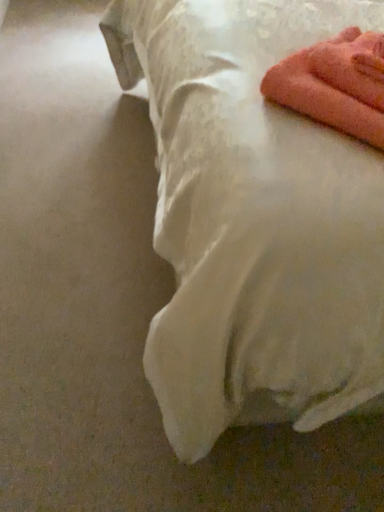
Find the location of a particular element. The image size is (384, 512). pink fluffy towel at upper right is located at coordinates (335, 84).

What do you see at coordinates (335, 84) in the screenshot? I see `pink fluffy towel at upper right` at bounding box center [335, 84].

What do you see at coordinates (254, 221) in the screenshot? I see `white satin bed at upper right` at bounding box center [254, 221].

Locate an element on the screen. Image resolution: width=384 pixels, height=512 pixels. white satin bed at upper right is located at coordinates (254, 221).

Measure the distance between white satin bed at upper right and camera.

The distance of white satin bed at upper right from camera is 25.53 inches.

What is the approximate height of white satin bed at upper right?

white satin bed at upper right is 1.03 meters tall.

This screenshot has width=384, height=512. I want to click on pink fluffy towel at upper right, so click(x=335, y=84).

Which is more to the right, white satin bed at upper right or pink fluffy towel at upper right?

pink fluffy towel at upper right.

Considering the positions of objects white satin bed at upper right and pink fluffy towel at upper right in the image provided, who is in front, white satin bed at upper right or pink fluffy towel at upper right?

Positioned in front is white satin bed at upper right.

Considering the points (227, 323) and (265, 90), which point is in front, point (227, 323) or point (265, 90)?

Positioned in front is point (227, 323).

From the image's perspective, between white satin bed at upper right and pink fluffy towel at upper right, which one is located above?

white satin bed at upper right.

From a real-world perspective, does white satin bed at upper right sit lower than pink fluffy towel at upper right?

Indeed, from a real-world perspective, white satin bed at upper right is positioned beneath pink fluffy towel at upper right.

Looking at their sizes, would you say white satin bed at upper right is wider or thinner than pink fluffy towel at upper right?

In the image, white satin bed at upper right appears to be wider than pink fluffy towel at upper right.

Considering the sizes of objects white satin bed at upper right and pink fluffy towel at upper right in the image provided, who is shorter, white satin bed at upper right or pink fluffy towel at upper right?

With less height is pink fluffy towel at upper right.

Does white satin bed at upper right have a larger size compared to pink fluffy towel at upper right?

Indeed, white satin bed at upper right has a larger size compared to pink fluffy towel at upper right.

Is white satin bed at upper right completely or partially outside of pink fluffy towel at upper right?

Indeed, white satin bed at upper right is completely outside pink fluffy towel at upper right.

Are white satin bed at upper right and pink fluffy towel at upper right located far from each other?

That's not correct — white satin bed at upper right is a little close to pink fluffy towel at upper right.

Is pink fluffy towel at upper right at the back of white satin bed at upper right?

Yes, white satin bed at upper right is positioned with its back facing pink fluffy towel at upper right.

Locate an element on the screen. The image size is (384, 512). towel behind the white satin bed at upper right is located at coordinates (335, 84).

Based on the photo, would you say pink fluffy towel at upper right is to the left or to the right of white satin bed at upper right in the picture?

Based on their positions, pink fluffy towel at upper right is located to the right of white satin bed at upper right.

Is pink fluffy towel at upper right in front of white satin bed at upper right?

No, it is not.

Is point (355, 77) closer to viewer compared to point (283, 412)?

Yes, point (355, 77) is closer to viewer.

From the image's perspective, which is above, pink fluffy towel at upper right or white satin bed at upper right?

white satin bed at upper right is shown above in the image.

From a real-world perspective, which object stands above the other?

pink fluffy towel at upper right, from a real-world perspective.

Looking at their sizes, would you say pink fluffy towel at upper right is wider or thinner than white satin bed at upper right?

pink fluffy towel at upper right is thinner than white satin bed at upper right.

Consider the image. Considering the sizes of objects pink fluffy towel at upper right and white satin bed at upper right in the image provided, who is taller, pink fluffy towel at upper right or white satin bed at upper right?

With more height is white satin bed at upper right.

Is pink fluffy towel at upper right bigger than white satin bed at upper right?

Actually, pink fluffy towel at upper right might be smaller than white satin bed at upper right.

Can white satin bed at upper right be found inside pink fluffy towel at upper right?

No, white satin bed at upper right is not surrounded by pink fluffy towel at upper right.

Is pink fluffy towel at upper right next to white satin bed at upper right?

There is a gap between pink fluffy towel at upper right and white satin bed at upper right.

Based on the photo, is pink fluffy towel at upper right facing away from white satin bed at upper right?

Correct, pink fluffy towel at upper right is looking away from white satin bed at upper right.

How many degrees apart are the facing directions of pink fluffy towel at upper right and white satin bed at upper right?

The angle between the facing direction of pink fluffy towel at upper right and the facing direction of white satin bed at upper right is 134 degrees.

You are a GUI agent. You are given a task and a screenshot of the screen. Output one action in this format:
    pyautogui.click(x=<x>, y=<y>)
    Task: Click on the bed that is in front of the pink fluffy towel at upper right
    Image resolution: width=384 pixels, height=512 pixels.
    Given the screenshot: What is the action you would take?
    pyautogui.click(x=254, y=221)

What are the coordinates of `bed that is under the pink fluffy towel at upper right (from a real-world perspective)` in the screenshot? It's located at (254, 221).

At what (x,y) coordinates should I click in order to perform the action: click on bed above the pink fluffy towel at upper right (from the image's perspective). Please return your answer as a coordinate pair (x, y). This screenshot has height=512, width=384. Looking at the image, I should click on (254, 221).